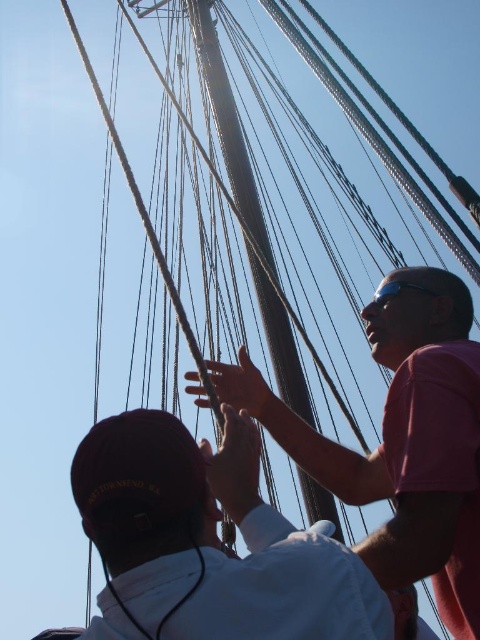
Is white matte shirt at center bigger than pink matte shirt at upper right?

No.

Image resolution: width=480 pixels, height=640 pixels. What do you see at coordinates (208, 541) in the screenshot? I see `white matte shirt at center` at bounding box center [208, 541].

I want to click on white matte shirt at center, so click(208, 541).

Which is below, pink matte shirt at upper right or smooth wood mast at center?

pink matte shirt at upper right

I want to click on pink matte shirt at upper right, so click(x=403, y=440).

Is white matte shirt at center above smooth wood mast at center?

Incorrect, white matte shirt at center is not positioned above smooth wood mast at center.

Which is behind, point (259, 512) or point (210, 96)?

Point (210, 96)

Does point (167, 577) come closer to viewer compared to point (236, 193)?

Yes.

At what (x,y) coordinates should I click in order to perform the action: click on white matte shirt at center. Please return your answer as a coordinate pair (x, y). This screenshot has height=640, width=480. Looking at the image, I should click on (208, 541).